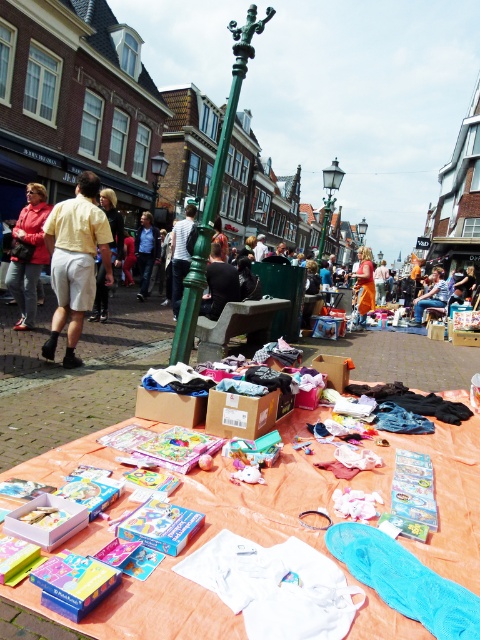
Question: Among these points, which one is farthest from the camera?

Choices:
 (A) (56, 273)
 (B) (226, 131)

Answer: (B)

Question: Among these points, which one is nearest to the camera?

Choices:
 (A) (39, 212)
 (B) (433, 282)
 (C) (115, 227)

Answer: (A)

Question: Is black fabric jacket at center wider than matte black clothing at center?

Choices:
 (A) yes
 (B) no

Answer: (B)

Question: Which is farther from the matte black clothing at center?

Choices:
 (A) blue denim jeans at center
 (B) dark gray fabric at center
 (C) green metal streetlight at center

Answer: (C)

Question: Does green polished metal pole at center have a greater width compared to blue denim jeans at center?

Choices:
 (A) no
 (B) yes

Answer: (B)

Question: Can you confirm if matte red jacket at left is smaller than orange cotton dress at center?

Choices:
 (A) no
 (B) yes

Answer: (B)